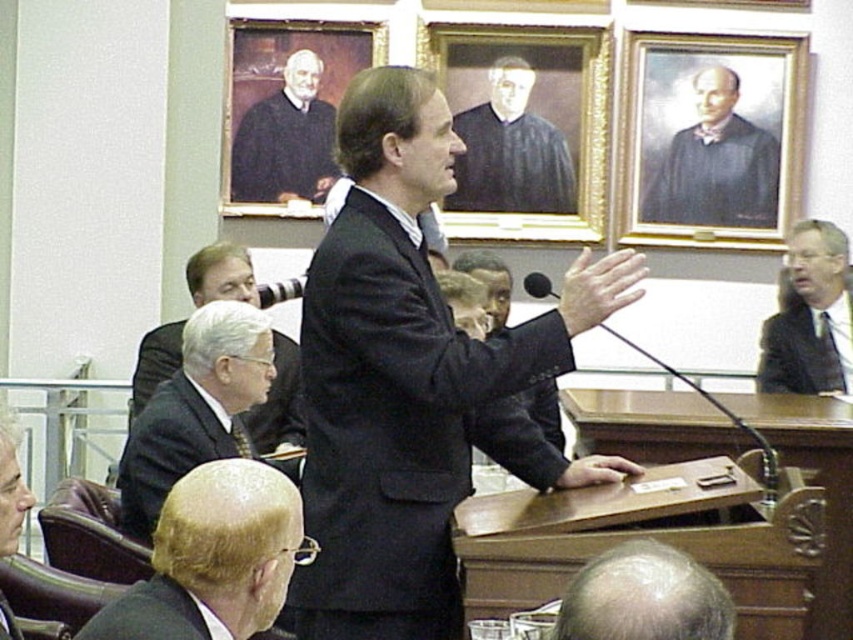
Between point (813, 328) and point (636, 465), which one is positioned behind?

Point (813, 328)

Is matte black suit at upper right wider than matte black hand at center?

Yes, matte black suit at upper right is wider than matte black hand at center.

This screenshot has height=640, width=853. What are the coordinates of `matte black suit at upper right` in the screenshot? It's located at click(810, 316).

Is black robe at center positioned before white matte hand at center?

No, it is not.

Is point (550, 188) positioned in front of point (593, 316)?

No.

Where is `black robe at center`? This screenshot has width=853, height=640. black robe at center is located at coordinates (511, 150).

Does point (585, 579) lie behind point (6, 541)?

No.

Does gray hair at center appear under smooth black suit at lower left?

Actually, gray hair at center is above smooth black suit at lower left.

Find the location of a particular element. Image resolution: width=853 pixels, height=640 pixels. gray hair at center is located at coordinates (643, 596).

At what (x,y) coordinates should I click in order to perform the action: click on gray hair at center. Please return your answer as a coordinate pair (x, y). The height and width of the screenshot is (640, 853). Looking at the image, I should click on (643, 596).